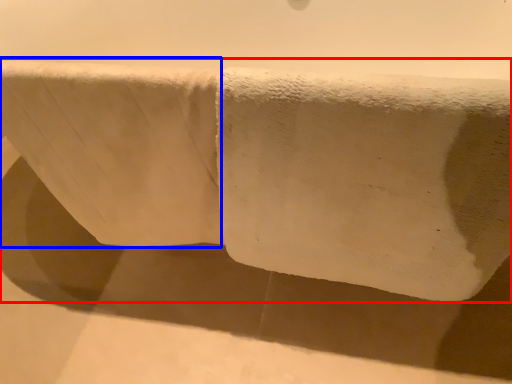
Question: Which object is further to the camera taking this photo, towel (highlighted by a red box) or bath towel (highlighted by a blue box)?

Choices:
 (A) towel
 (B) bath towel

Answer: (B)